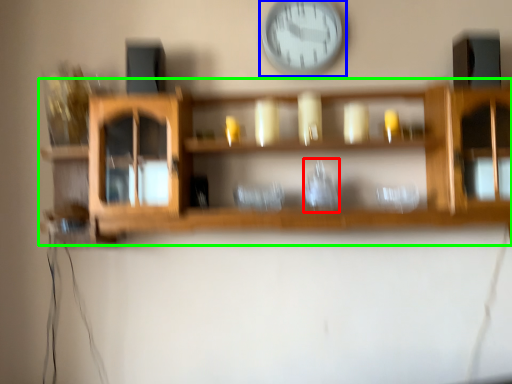
Question: Which is nearer to the glass vase (highlighted by a red box)? wall clock (highlighted by a blue box) or shelf (highlighted by a green box).

Choices:
 (A) wall clock
 (B) shelf

Answer: (B)